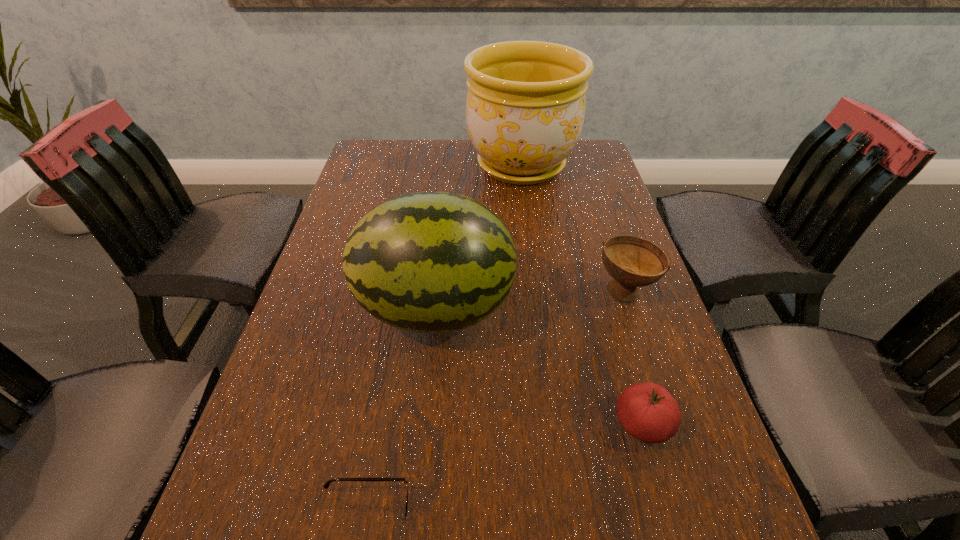
The width and height of the screenshot is (960, 540). What are the coordinates of `vacant area in the image that satisfies the following two spatial constraints: 1. on the front side of the flowerpot; 2. at the stem end of the fourth shortest object` in the screenshot? It's located at (540, 309).